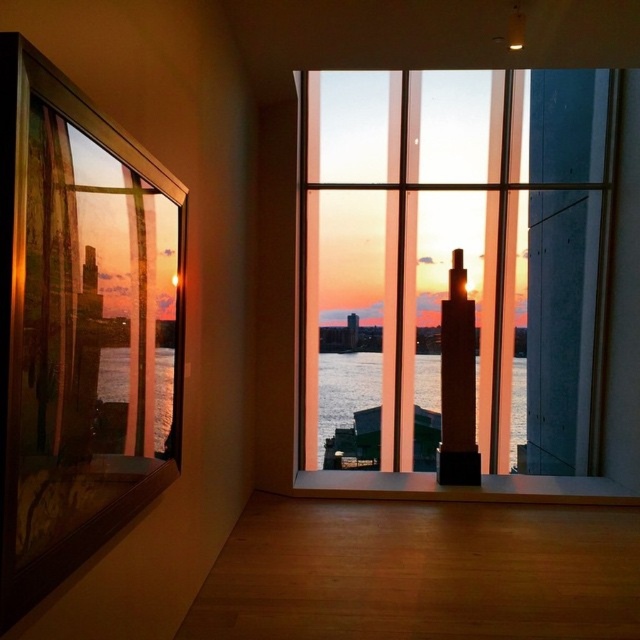
Who is higher up, transparent glass window at left or translucent glass water at center?

transparent glass window at left

Can you confirm if transparent glass window at left is thinner than translucent glass water at center?

Correct, transparent glass window at left's width is less than translucent glass water at center's.

Which is behind, point (115, 150) or point (355, 396)?

The point (355, 396) is more distant.

I want to click on transparent glass window at left, so click(80, 326).

Between transparent glass window at left and transparent glass water at left, which one appears on the right side from the viewer's perspective?

transparent glass water at left is more to the right.

In the scene shown: Can you confirm if transparent glass window at left is taller than transparent glass water at left?

Yes.

What do you see at coordinates (80, 326) in the screenshot? Image resolution: width=640 pixels, height=640 pixels. I see `transparent glass window at left` at bounding box center [80, 326].

Locate an element on the screen. transparent glass window at left is located at coordinates (80, 326).

Between point (138, 451) and point (436, 392), which one is positioned behind?

Positioned behind is point (436, 392).

The height and width of the screenshot is (640, 640). What do you see at coordinates (134, 401) in the screenshot?
I see `transparent glass water at left` at bounding box center [134, 401].

Which is behind, point (131, 397) or point (433, 387)?

Positioned behind is point (433, 387).

You are a GUI agent. You are given a task and a screenshot of the screen. Output one action in this format:
    pyautogui.click(x=<x>, y=<y>)
    Task: Click on the transparent glass water at left
    
    Given the screenshot: What is the action you would take?
    pyautogui.click(x=134, y=401)